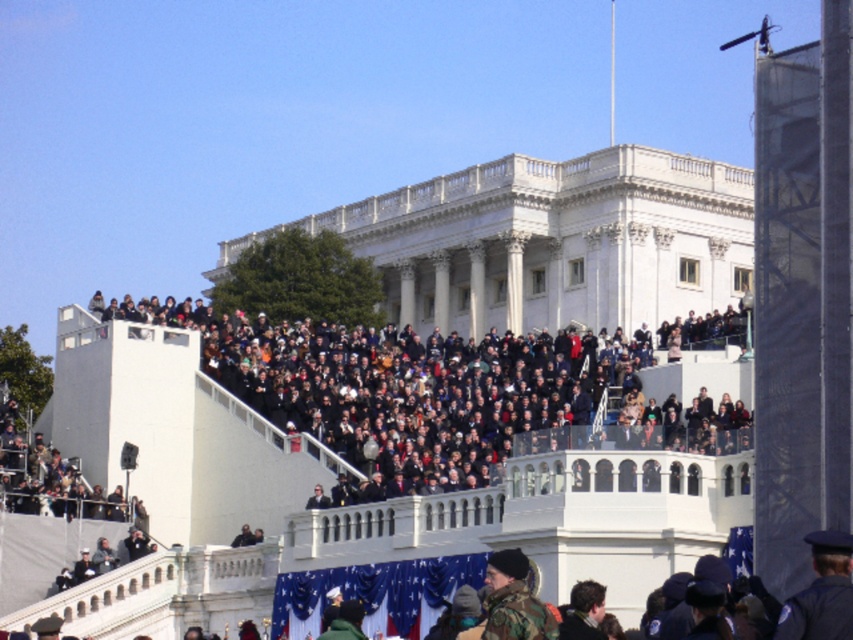
Can you confirm if dark blue uniform at lower right is positioned to the right of camouflage jacket at lower center?

Indeed, dark blue uniform at lower right is positioned on the right side of camouflage jacket at lower center.

How distant is dark blue uniform at lower right from camouflage jacket at lower center?

dark blue uniform at lower right and camouflage jacket at lower center are 5.09 meters apart from each other.

The width and height of the screenshot is (853, 640). I want to click on dark blue uniform at lower right, so click(x=822, y=593).

I want to click on dark blue uniform at lower right, so click(822, 593).

Is dark gray concrete crowd at upper center wider than dark blue uniform at lower right?

Correct, the width of dark gray concrete crowd at upper center exceeds that of dark blue uniform at lower right.

Identify the location of dark gray concrete crowd at upper center. (450, 400).

This screenshot has width=853, height=640. What do you see at coordinates (450, 400) in the screenshot?
I see `dark gray concrete crowd at upper center` at bounding box center [450, 400].

Does dark gray concrete crowd at upper center have a greater width compared to camouflage jacket at lower center?

Correct, the width of dark gray concrete crowd at upper center exceeds that of camouflage jacket at lower center.

You are a GUI agent. You are given a task and a screenshot of the screen. Output one action in this format:
    pyautogui.click(x=<x>, y=<y>)
    Task: Click on the dark gray concrete crowd at upper center
    This screenshot has height=640, width=853.
    Given the screenshot: What is the action you would take?
    pyautogui.click(x=450, y=400)